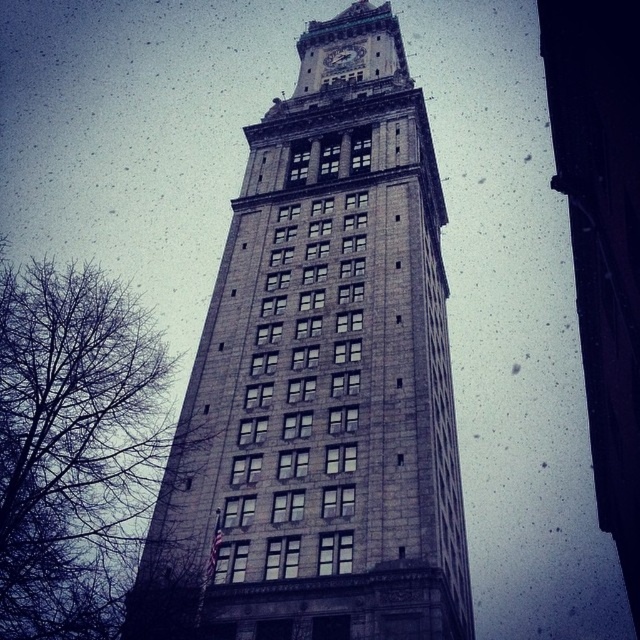
You are standing in front of the historic building and notice the gray stone clock tower at center and the white marble clock at upper center. Which one is closer to you?

The gray stone clock tower at center is closer to you because it is in front of the white marble clock at upper center.

You are standing in front of the historic building and want to take a photo of the gray stone clock tower at center. According to the image, where should you aim your camera to capture the clock tower in the frame?

The gray stone clock tower at center is located at the 2D coordinates point (x=321, y=381), so you should aim your camera at that point to capture it in the frame.